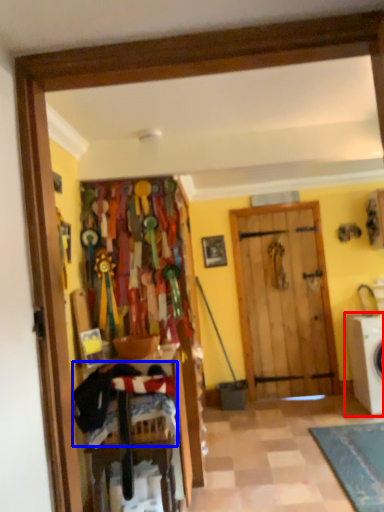
Question: Which point is further to the camera, washing machine (highlighted by a red box) or laundry (highlighted by a blue box)?

Choices:
 (A) washing machine
 (B) laundry

Answer: (A)